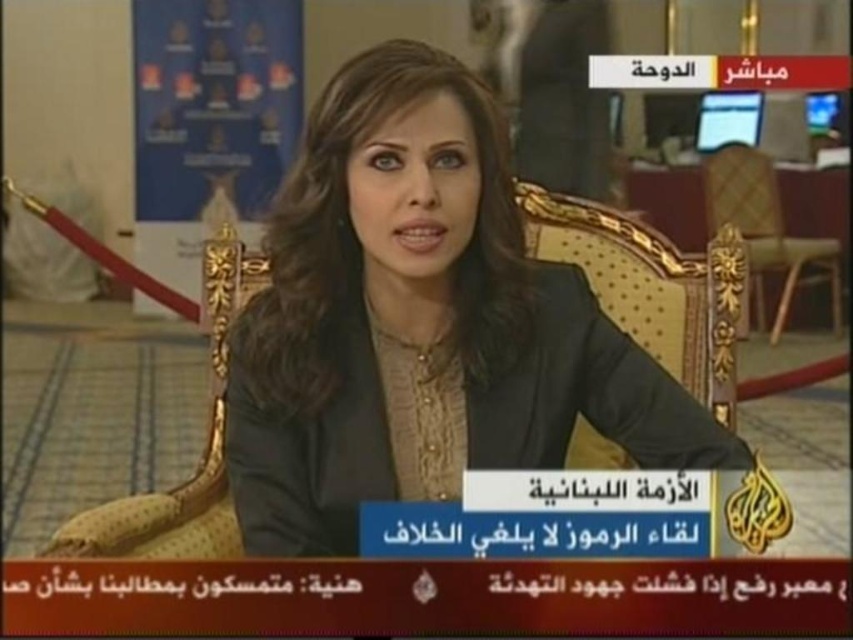
Question: Can you confirm if matte black suit at center is positioned above wooden armchair at center?

Choices:
 (A) no
 (B) yes

Answer: (A)

Question: Is matte black suit at center closer to the viewer compared to wooden armchair at center?

Choices:
 (A) yes
 (B) no

Answer: (A)

Question: Which of the following is the closest to the observer?

Choices:
 (A) (726, 189)
 (B) (396, 278)

Answer: (B)

Question: Which point is farther from the camera taking this photo?

Choices:
 (A) (743, 220)
 (B) (537, 433)

Answer: (A)

Question: Can you confirm if matte black suit at center is thinner than wooden armchair at center?

Choices:
 (A) yes
 (B) no

Answer: (B)